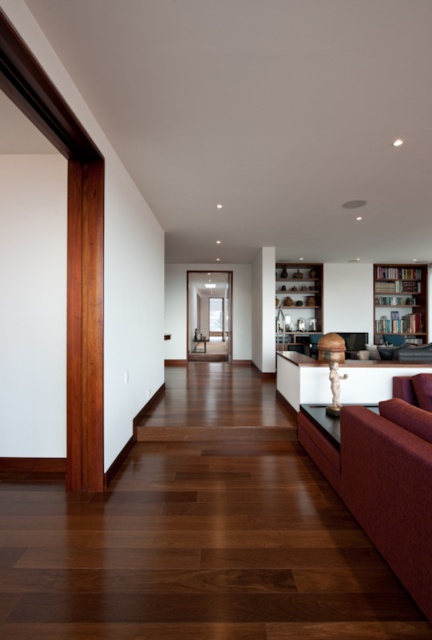
You are a delivery person who needs to place a large package that is 2 meters in length between the burgundy fabric couch at lower right and the wooden bookshelf at right. Is there enough space between them to fit the package?

The distance between the burgundy fabric couch at lower right and the wooden bookshelf at right is 8.31 meters, which is more than enough to accommodate the 2 meter long package.

You are standing at the entrance of the room and want to sit on the burgundy fabric couch at lower right. Based on its 2D coordinates, in which general direction should you walk from the entrance? Assume the entrance is at the bottom left corner of the room.

The burgundy fabric couch at lower right is located at coordinates 0.758 on the x axis and 0.910 on the y axis. Since the entrance is at the bottom left corner, you should walk towards the upper right direction to reach the couch.